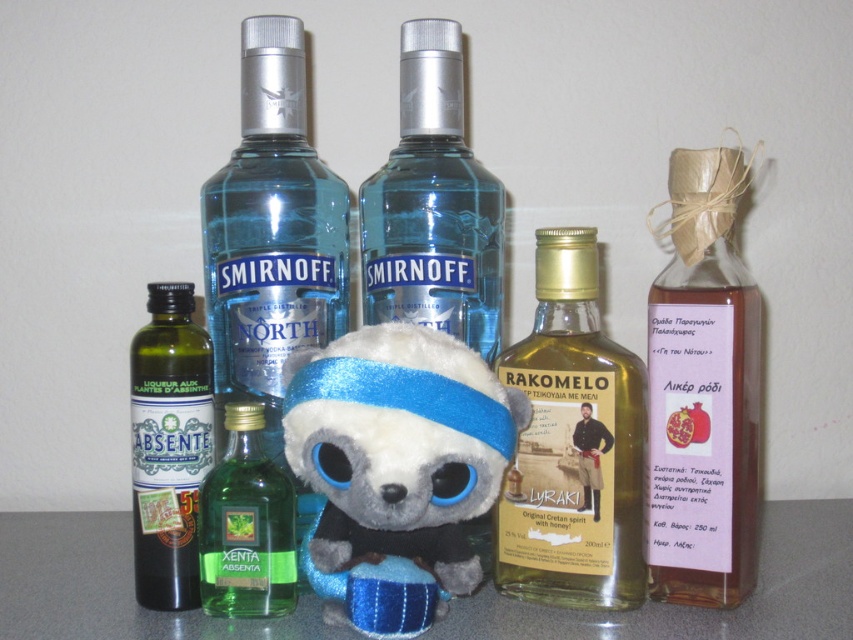
Which is in front, point (654, 445) or point (497, 285)?

Point (654, 445) is in front.

Who is more forward, (676,243) or (498,216)?

Point (676,243) is in front.

This screenshot has width=853, height=640. I want to click on translucent paper wrapped bottle at right, so click(x=703, y=392).

Which of these two, green glass bottle at left or green glass bottle at center, stands taller?

green glass bottle at left is taller.

Who is higher up, green glass bottle at left or green glass bottle at center?

green glass bottle at left

This screenshot has height=640, width=853. I want to click on green glass bottle at left, so click(x=167, y=445).

The width and height of the screenshot is (853, 640). Find the location of `green glass bottle at left`. green glass bottle at left is located at coordinates (167, 445).

Is point (318, 484) farther from viewer compared to point (605, 428)?

No.

Which is behind, point (415, 388) or point (560, 401)?

Positioned behind is point (560, 401).

The width and height of the screenshot is (853, 640). What are the coordinates of `fluffy plush toy at center` in the screenshot? It's located at (399, 448).